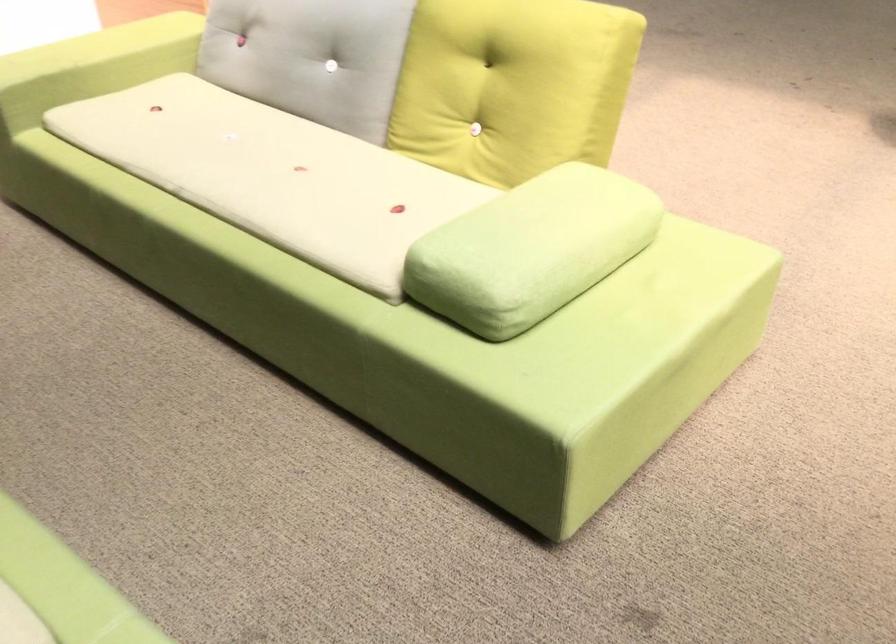
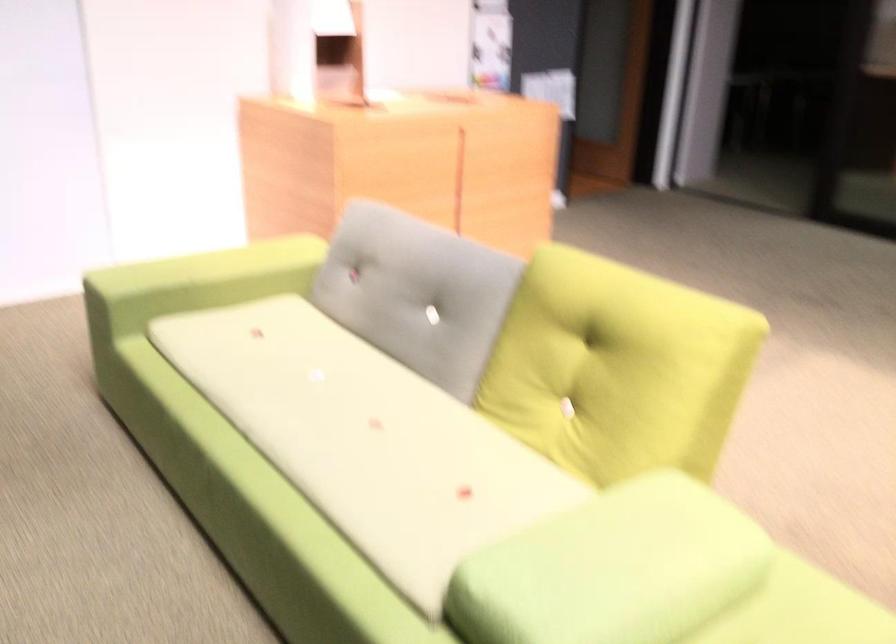
Question: Which direction would the cameraman need to move to produce the second image? Reply with the corresponding letter.

Choices:
 (A) Left
 (B) Right
 (C) Forward
 (D) Backward

Answer: (C)